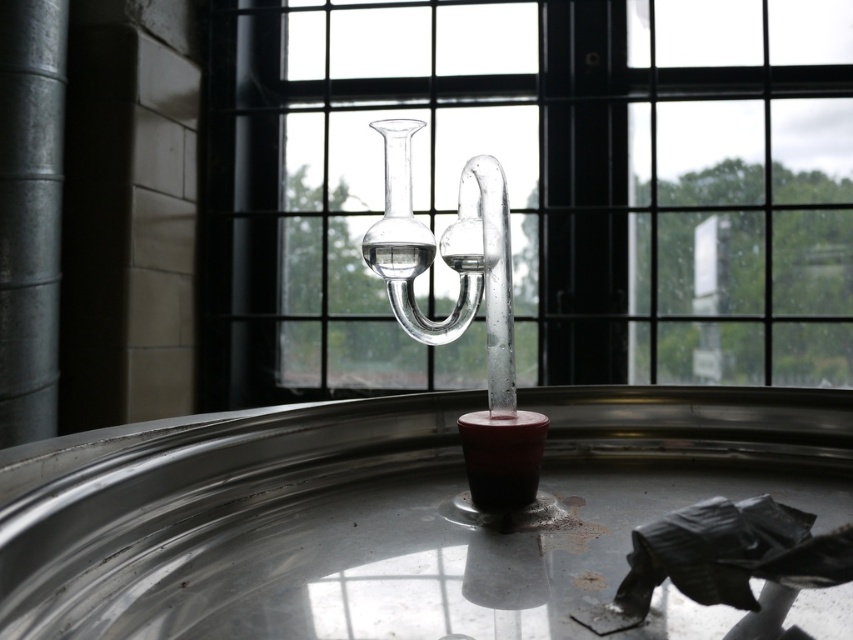
Does transparent glass window at center have a smaller size compared to smooth metallic pillar at left?

Incorrect, transparent glass window at center is not smaller in size than smooth metallic pillar at left.

Is transparent glass window at center to the right of smooth metallic pillar at left from the viewer's perspective?

Yes, transparent glass window at center is to the right of smooth metallic pillar at left.

Between point (293, 308) and point (33, 144), which one is positioned in front?

Point (33, 144)

Find the location of a particular element. The height and width of the screenshot is (640, 853). transparent glass window at center is located at coordinates (532, 188).

Who is higher up, smooth metallic pillar at left or transparent glass vase at center?

smooth metallic pillar at left

Does smooth metallic pillar at left have a lesser width compared to transparent glass vase at center?

No, smooth metallic pillar at left is not thinner than transparent glass vase at center.

Does point (42, 273) come behind point (403, 260)?

Yes, it is behind point (403, 260).

This screenshot has width=853, height=640. What are the coordinates of `smooth metallic pillar at left` in the screenshot? It's located at (28, 212).

Can you confirm if transparent glass window at center is positioned below transparent glass vase at center?

Incorrect, transparent glass window at center is not positioned below transparent glass vase at center.

In order to click on transparent glass window at center in this screenshot , I will do `click(532, 188)`.

The height and width of the screenshot is (640, 853). Describe the element at coordinates (532, 188) in the screenshot. I see `transparent glass window at center` at that location.

The height and width of the screenshot is (640, 853). Identify the location of transparent glass window at center. click(532, 188).